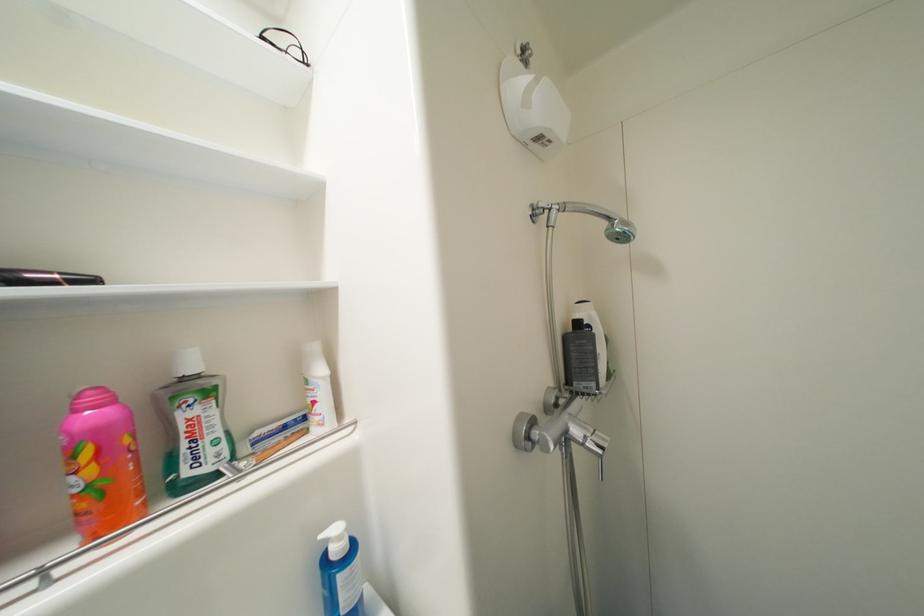
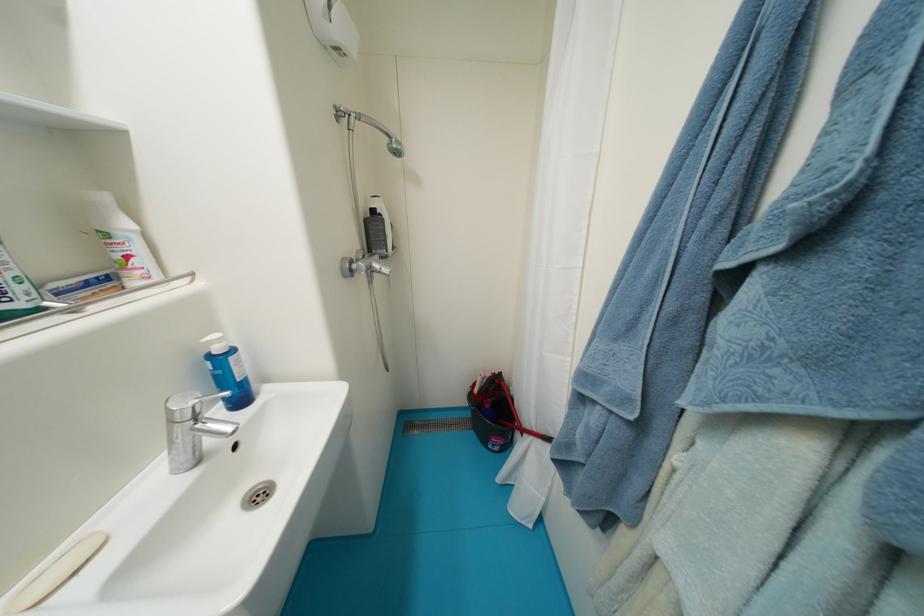
Find the pixel in the second image that matches (582,434) in the first image.

(383, 267)